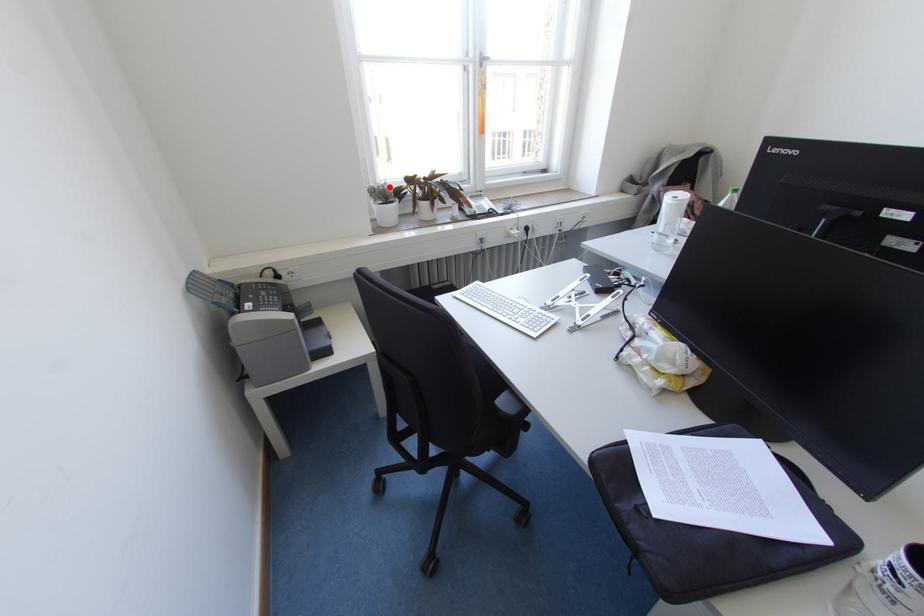
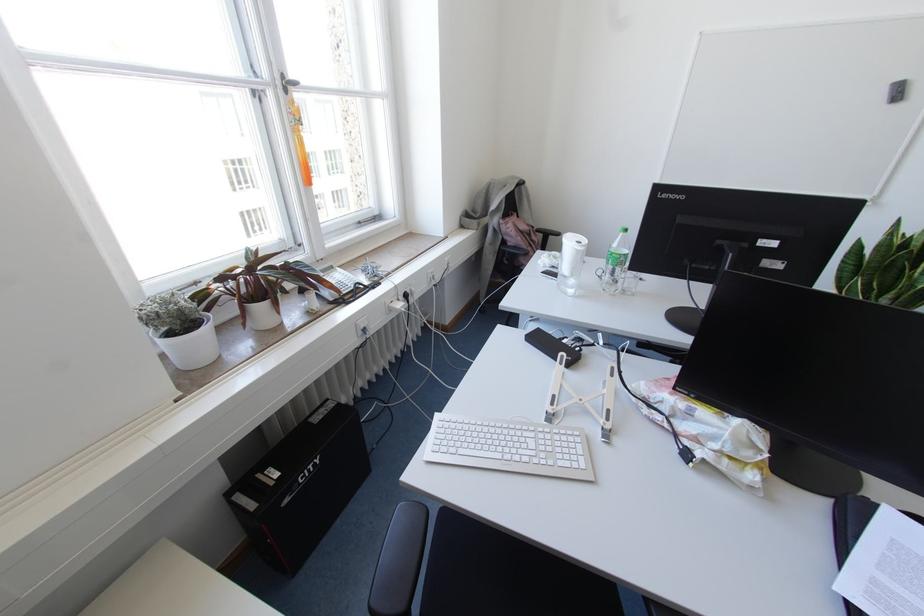
Find the pixel in the second image that matches the highlighted location in the first image.

(186, 298)